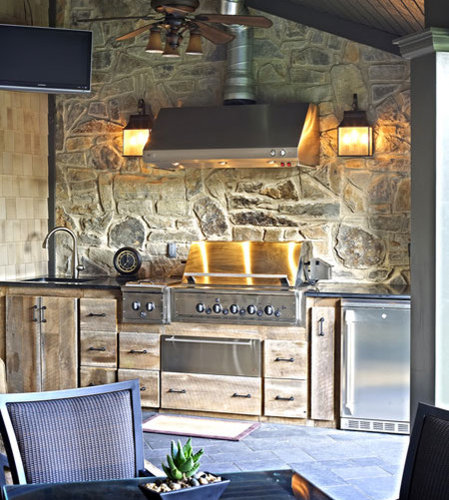
Where is `oven`? oven is located at coordinates (227, 346).